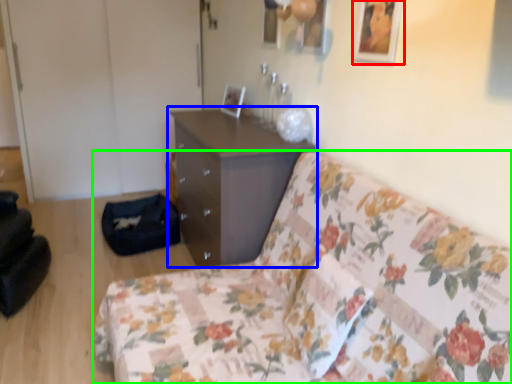
Question: Considering the real-world distances, which object is closest to picture frame (highlighted by a red box)? chest of drawers (highlighted by a blue box) or studio couch (highlighted by a green box).

Choices:
 (A) chest of drawers
 (B) studio couch

Answer: (B)